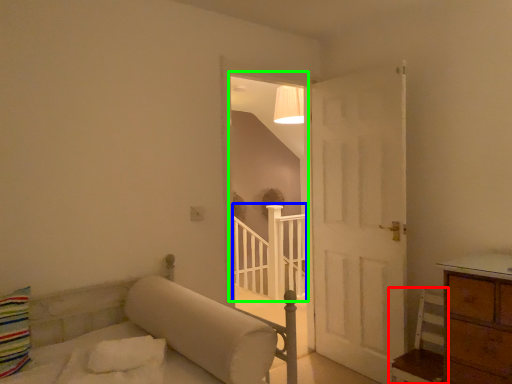
Question: Based on their relative distances, which object is farther from furniture (highlighted by a red box)? Choose from balustrade (highlighted by a blue box) and window (highlighted by a green box).

Choices:
 (A) balustrade
 (B) window

Answer: (B)